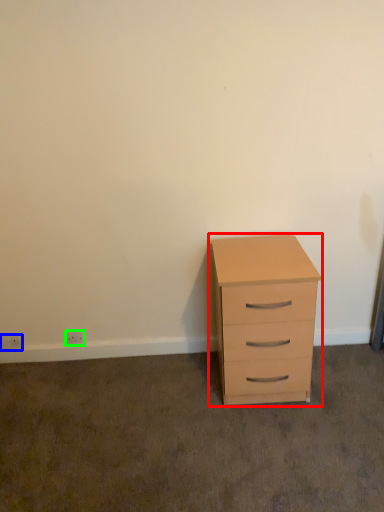
Question: Estimate the real-world distances between objects in this image. Which object is farther from chest of drawers (highlighted by a red box), electric outlet (highlighted by a blue box) or electric outlet (highlighted by a green box)?

Choices:
 (A) electric outlet
 (B) electric outlet

Answer: (A)